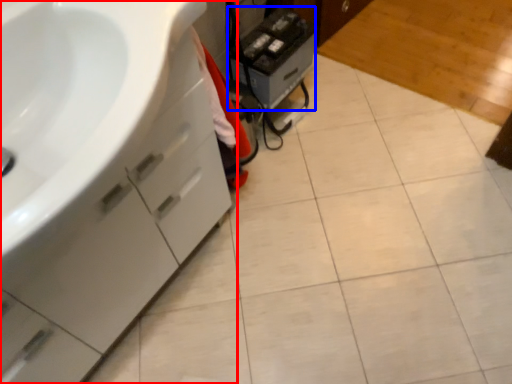
Question: Which of the following is the farthest to the observer, bathroom cabinet (highlighted by a red box) or appliance (highlighted by a blue box)?

Choices:
 (A) bathroom cabinet
 (B) appliance

Answer: (B)